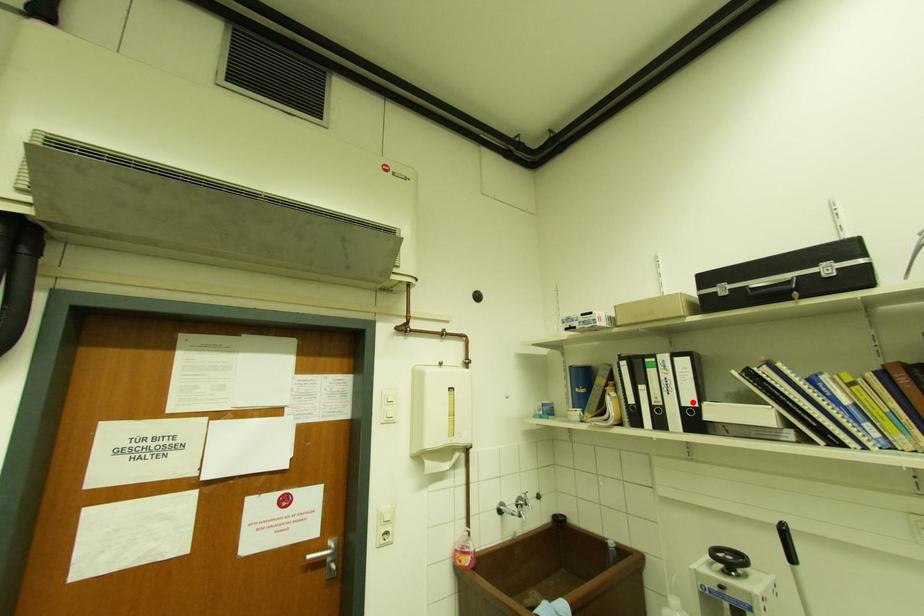
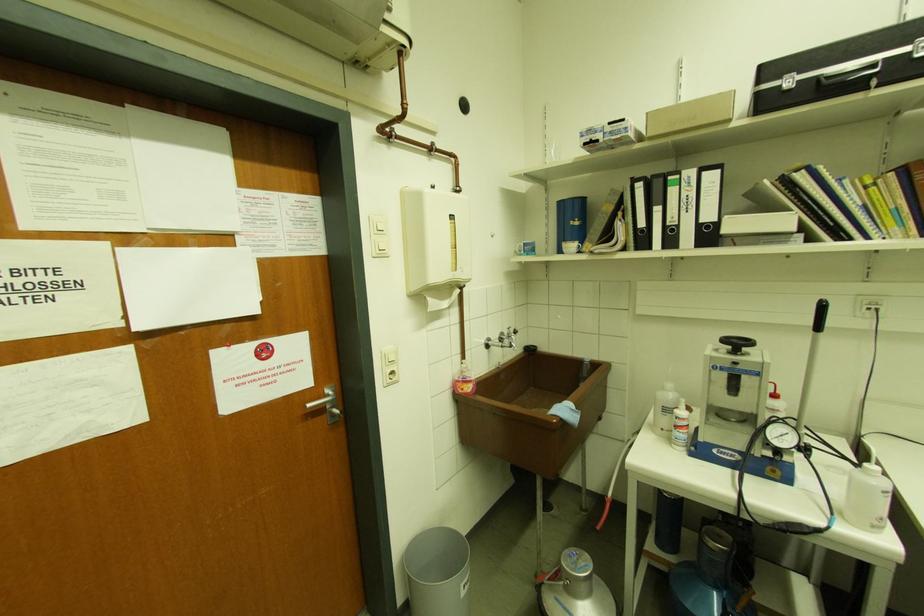
Locate, in the second image, the point that corresponds to the highlighted location in the first image.

(712, 217)